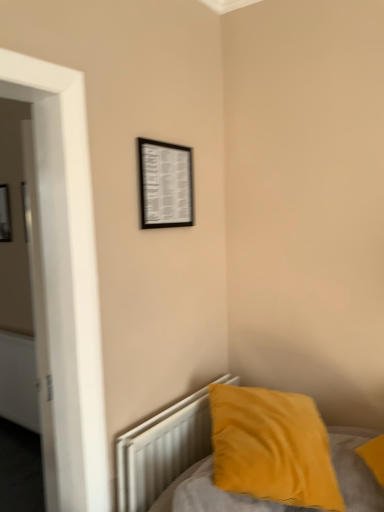
Question: Considering the relative sizes of velvet yellow pillow at lower right and black matte picture frame at upper center, the 1th picture frame in the front-to-back sequence, in the image provided, is velvet yellow pillow at lower right thinner than black matte picture frame at upper center, the 1th picture frame in the front-to-back sequence,?

Choices:
 (A) no
 (B) yes

Answer: (A)

Question: Could you tell me if velvet yellow pillow at lower right is facing black matte picture frame at upper center, acting as the second picture frame starting from the left?

Choices:
 (A) yes
 (B) no

Answer: (B)

Question: Is the depth of velvet yellow pillow at lower right greater than that of black matte picture frame at upper center, acting as the first picture frame starting from the right?

Choices:
 (A) yes
 (B) no

Answer: (B)

Question: Is velvet yellow pillow at lower right at the right side of black matte picture frame at upper center, acting as the second picture frame starting from the left?

Choices:
 (A) yes
 (B) no

Answer: (A)

Question: From the image's perspective, is velvet yellow pillow at lower right on top of black matte picture frame at upper center, acting as the first picture frame starting from the right?

Choices:
 (A) no
 (B) yes

Answer: (A)

Question: Considering the relative sizes of velvet yellow pillow at lower right and black matte picture frame at upper center, acting as the first picture frame starting from the right, in the image provided, is velvet yellow pillow at lower right smaller than black matte picture frame at upper center, acting as the first picture frame starting from the right,?

Choices:
 (A) yes
 (B) no

Answer: (B)

Question: Is white metallic radiator at lower right at the back of black matte picture frame at upper center, the 1th picture frame in the front-to-back sequence?

Choices:
 (A) yes
 (B) no

Answer: (B)

Question: From the image's perspective, is black matte picture frame at upper center, which ranks as the second picture frame in back-to-front order, over white metallic radiator at lower right?

Choices:
 (A) no
 (B) yes

Answer: (B)

Question: From the image's perspective, is black matte picture frame at upper center, acting as the second picture frame starting from the left, below white metallic radiator at lower right?

Choices:
 (A) no
 (B) yes

Answer: (A)

Question: Considering the relative sizes of black matte picture frame at upper center, acting as the first picture frame starting from the right, and white metallic radiator at lower right in the image provided, is black matte picture frame at upper center, acting as the first picture frame starting from the right, taller than white metallic radiator at lower right?

Choices:
 (A) yes
 (B) no

Answer: (B)

Question: Is black matte picture frame at upper center, the 1th picture frame in the front-to-back sequence, with white metallic radiator at lower right?

Choices:
 (A) yes
 (B) no

Answer: (B)

Question: Does black matte picture frame at upper center, acting as the second picture frame starting from the left, have a lesser height compared to white metallic radiator at lower right?

Choices:
 (A) yes
 (B) no

Answer: (A)

Question: From the image's perspective, is white metallic radiator at lower right under black matte picture frame at upper left, which is counted as the 1th picture frame, starting from the left?

Choices:
 (A) yes
 (B) no

Answer: (A)